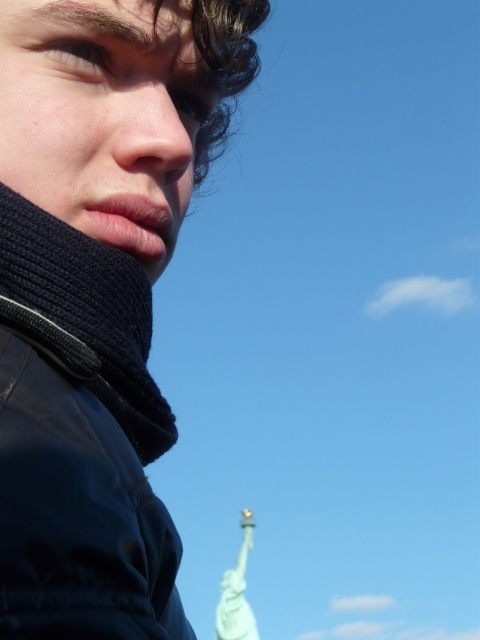
You are a photographer trying to capture a portrait. You notice the matte black scarf at lower left and the smooth skin nose at center in your frame. Which object occupies more horizontal space in the image?

The matte black scarf at lower left might be wider than the smooth skin nose at center according to the description.

You are taking a selfie and want to check if your scarf is positioned correctly. Looking at your selfie, is the matte black scarf at lower left placed to the left of your smooth skin nose at center?

Yes, the matte black scarf at lower left is positioned to the left of the smooth skin nose at center according to the description.